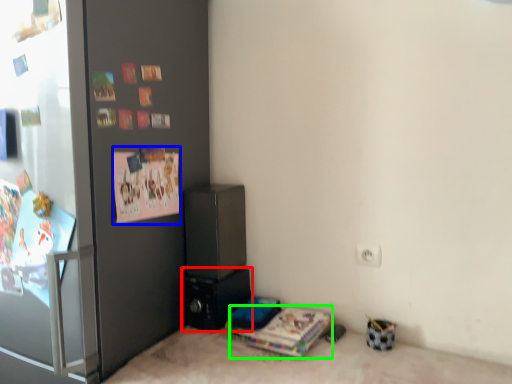
Question: Which object is the closest to the appliance (highlighted by a red box)? Choose among these: postcard (highlighted by a blue box) or magazine (highlighted by a green box).

Choices:
 (A) postcard
 (B) magazine

Answer: (B)